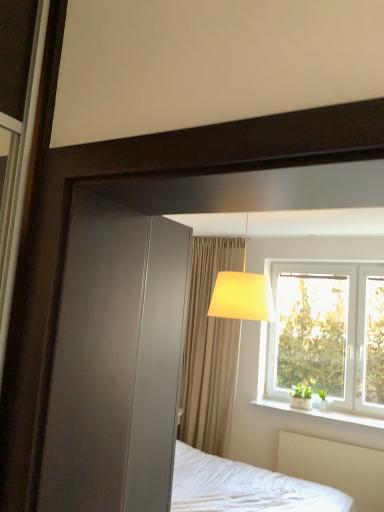
Where is `white plastic window at upper right`? white plastic window at upper right is located at coordinates (328, 333).

The height and width of the screenshot is (512, 384). What do you see at coordinates (328, 333) in the screenshot? I see `white plastic window at upper right` at bounding box center [328, 333].

Where is `white ceramic window sill at lower right`? Image resolution: width=384 pixels, height=512 pixels. white ceramic window sill at lower right is located at coordinates (321, 413).

Identify the location of white plastic window at upper right. (328, 333).

Can you confirm if beige fabric curtain at center is bigger than white textured radiator at lower right?

Yes.

Is the surface of beige fabric curtain at center in direct contact with white textured radiator at lower right?

beige fabric curtain at center and white textured radiator at lower right are clearly separated.

Does beige fabric curtain at center lie in front of white textured radiator at lower right?

No, beige fabric curtain at center is further to the viewer.

From a real-world perspective, is beige fabric curtain at center located beneath white textured radiator at lower right?

No, from a real-world perspective, beige fabric curtain at center is not beneath white textured radiator at lower right.

From a real-world perspective, is white textured radiator at lower right physically located above or below white plastic window at upper right?

white textured radiator at lower right is below white plastic window at upper right.

Is white textured radiator at lower right positioned far away from white plastic window at upper right?

Actually, white textured radiator at lower right and white plastic window at upper right are a little close together.

Is white plastic window at upper right located within white textured radiator at lower right?

No, white plastic window at upper right is not a part of white textured radiator at lower right.

In terms of size, does white textured radiator at lower right appear bigger or smaller than white plastic window at upper right?

Considering their sizes, white textured radiator at lower right takes up less space than white plastic window at upper right.

Where is `window sill below the white plastic window at upper right (from a real-world perspective)`? The width and height of the screenshot is (384, 512). window sill below the white plastic window at upper right (from a real-world perspective) is located at coordinates (321, 413).

Choose the correct answer: Is white ceramic window sill at lower right inside white plastic window at upper right or outside it?

white ceramic window sill at lower right is not enclosed by white plastic window at upper right.

Does white ceramic window sill at lower right have a larger size compared to white plastic window at upper right?

No, white ceramic window sill at lower right is not bigger than white plastic window at upper right.

Are white ceramic window sill at lower right and white plastic window at upper right far apart?

No, white ceramic window sill at lower right is not far from white plastic window at upper right.

Looking at this image, is white plastic window at upper right looking in the opposite direction of beige fabric curtain at center?

No, white plastic window at upper right's orientation is not away from beige fabric curtain at center.

From a real-world perspective, which is physically below, white plastic window at upper right or beige fabric curtain at center?

beige fabric curtain at center, from a real-world perspective.

Does white plastic window at upper right have a larger size compared to beige fabric curtain at center?

No.

This screenshot has height=512, width=384. In the image, there is a white plastic window at upper right. Find the location of `curtain below it (from a real-world perspective)`. curtain below it (from a real-world perspective) is located at coordinates (209, 351).

Relative to white ceramic window sill at lower right, is white textured radiator at lower right in front or behind?

Clearly, white textured radiator at lower right is in front of white ceramic window sill at lower right.

Which of these two, white textured radiator at lower right or white ceramic window sill at lower right, stands shorter?

white ceramic window sill at lower right is shorter.

Which of these two, white textured radiator at lower right or white ceramic window sill at lower right, is smaller?

With smaller size is white ceramic window sill at lower right.

In the image, is white textured radiator at lower right on the left side or the right side of white ceramic window sill at lower right?

white textured radiator at lower right is positioned on white ceramic window sill at lower right's right side.

From the image's perspective, is matte yellow fabric lampshade at upper center below white ceramic window sill at lower right?

Actually, matte yellow fabric lampshade at upper center appears above white ceramic window sill at lower right in the image.

Is matte yellow fabric lampshade at upper center facing away from white ceramic window sill at lower right?

No.

The width and height of the screenshot is (384, 512). Identify the location of window sill on the right of matte yellow fabric lampshade at upper center. (321, 413).

Can you tell me how much matte yellow fabric lampshade at upper center and white ceramic window sill at lower right differ in facing direction?

The angular difference between matte yellow fabric lampshade at upper center and white ceramic window sill at lower right is 10.9 degrees.

Consider the image. Considering the sizes of objects white plastic window at upper right and white ceramic window sill at lower right in the image provided, who is wider, white plastic window at upper right or white ceramic window sill at lower right?

white ceramic window sill at lower right is wider.

Is white plastic window at upper right inside or outside of white ceramic window sill at lower right?

white plastic window at upper right is spatially situated outside white ceramic window sill at lower right.

From the image's perspective, is white plastic window at upper right below white ceramic window sill at lower right?

No.

You are a GUI agent. You are given a task and a screenshot of the screen. Output one action in this format:
    pyautogui.click(x=<x>, y=<y>)
    Task: Click on the window lying on the right of white ceramic window sill at lower right
    The height and width of the screenshot is (512, 384).
    Given the screenshot: What is the action you would take?
    pyautogui.click(x=328, y=333)

The width and height of the screenshot is (384, 512). Find the location of `curtain behind the white textured radiator at lower right`. curtain behind the white textured radiator at lower right is located at coordinates pyautogui.click(x=209, y=351).

Identify the location of radiator that appears below the white plastic window at upper right (from a real-world perspective). pos(335,467).

Based on their spatial positions, is matte yellow fabric lampshade at upper center or white plastic window at upper right further from white ceramic window sill at lower right?

matte yellow fabric lampshade at upper center.

Which object lies nearer to the anchor point white plastic window at upper right, beige fabric curtain at center or matte yellow fabric lampshade at upper center?

Among the two, beige fabric curtain at center is located nearer to white plastic window at upper right.

Which object lies nearer to the anchor point white ceramic window sill at lower right, matte yellow fabric lampshade at upper center or white textured radiator at lower right?

Based on the image, white textured radiator at lower right appears to be nearer to white ceramic window sill at lower right.

Looking at the image, which one is located further to white ceramic window sill at lower right, white textured radiator at lower right or beige fabric curtain at center?

Among the two, beige fabric curtain at center is located further to white ceramic window sill at lower right.

Considering their positions, is white ceramic window sill at lower right positioned closer to matte yellow fabric lampshade at upper center than white textured radiator at lower right?

Based on the image, white ceramic window sill at lower right appears to be nearer to matte yellow fabric lampshade at upper center.

Estimate the real-world distances between objects in this image. Which object is closer to matte yellow fabric lampshade at upper center, beige fabric curtain at center or white ceramic window sill at lower right?

Based on the image, beige fabric curtain at center appears to be nearer to matte yellow fabric lampshade at upper center.

Estimate the real-world distances between objects in this image. Which object is further from white plastic window at upper right, matte yellow fabric lampshade at upper center or beige fabric curtain at center?

matte yellow fabric lampshade at upper center is positioned further to the anchor white plastic window at upper right.

Based on their spatial positions, is white textured radiator at lower right or matte yellow fabric lampshade at upper center closer to white ceramic window sill at lower right?

The object closer to white ceramic window sill at lower right is white textured radiator at lower right.

Find the location of a particular element. window sill between beige fabric curtain at center and white textured radiator at lower right from left to right is located at coordinates (321, 413).

The height and width of the screenshot is (512, 384). What are the coordinates of `curtain between matte yellow fabric lampshade at upper center and white textured radiator at lower right vertically` in the screenshot? It's located at (209, 351).

You are a GUI agent. You are given a task and a screenshot of the screen. Output one action in this format:
    pyautogui.click(x=<x>, y=<y>)
    Task: Click on the window sill between matte yellow fabric lampshade at upper center and white textured radiator at lower right in the vertical direction
    Image resolution: width=384 pixels, height=512 pixels.
    Given the screenshot: What is the action you would take?
    pyautogui.click(x=321, y=413)

At what (x,y) coordinates should I click in order to perform the action: click on window between matte yellow fabric lampshade at upper center and beige fabric curtain at center in the front-back direction. Please return your answer as a coordinate pair (x, y). This screenshot has width=384, height=512. Looking at the image, I should click on (328, 333).